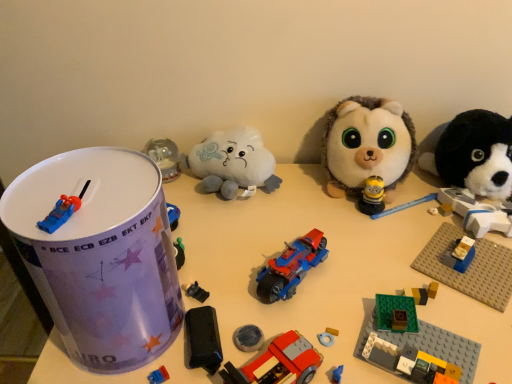
Identify the location of free space that is in between shiny plastic motorcycle at center, the 4th toy viewed from the right, and white plush cloud at center, which appears as the seventh toy when viewed from the right. (244, 229).